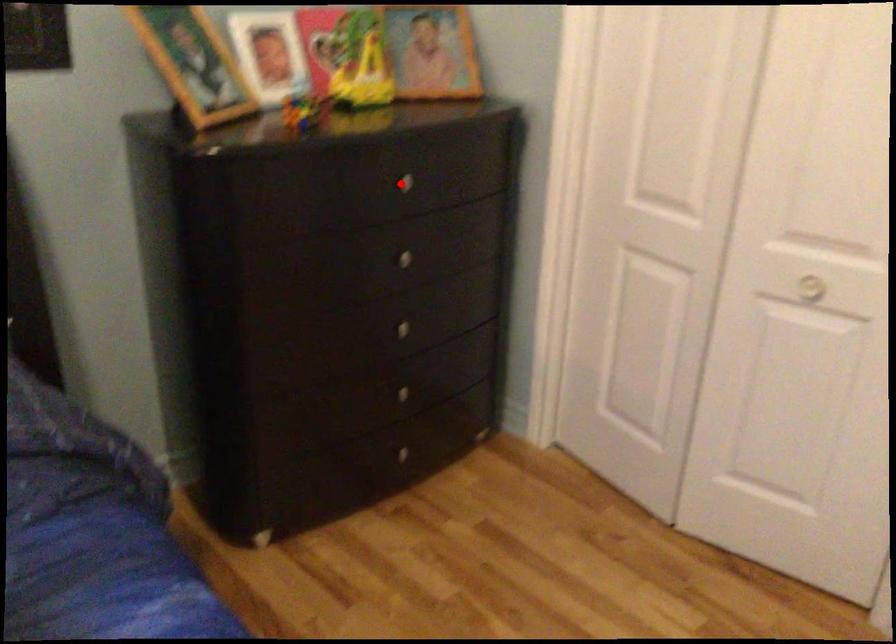
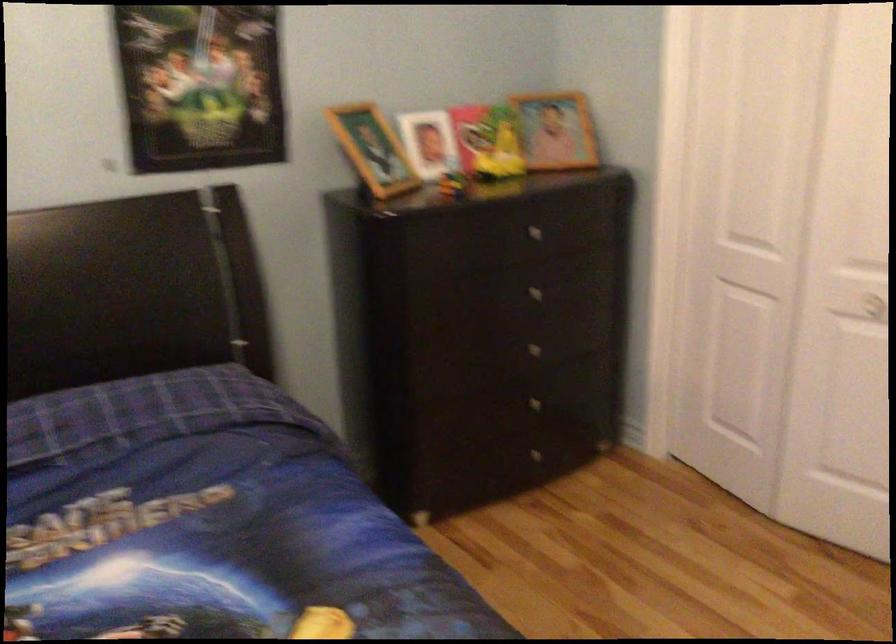
Question: I am providing you with two images of the same scene from different viewpoints. Image1 has a red point marked. In image2, the corresponding 3D location appears at what relative position? Reply with the corresponding letter.

Choices:
 (A) Closer
 (B) Farther

Answer: (B)